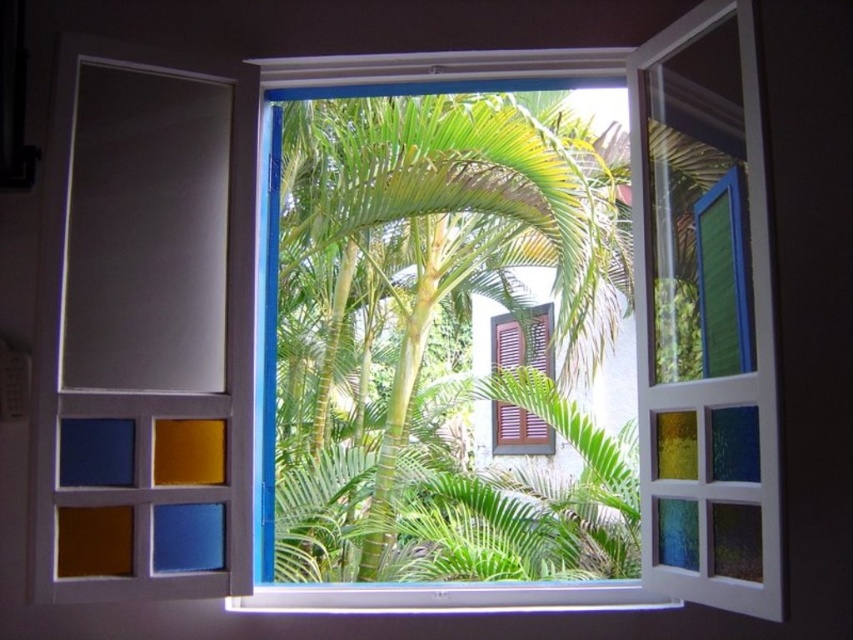
You are standing in a room with the window described. You want to place a small potted plant on the window sill. Based on the size of the white plastic window sill at lower center and the green leafy palm tree at center, can the potted plant fit on the window sill?

The green leafy palm tree at center is larger than the white plastic window sill at lower center. Since the palm tree is larger, the window sill might be too small to accommodate a potted plant of similar size, but since the potted plant is small, it should fit unless the window sill is unusually narrow. However, the description only states the palm tree is larger, so we can assume the window sill is smaller but still possibly adequate for a small plant.